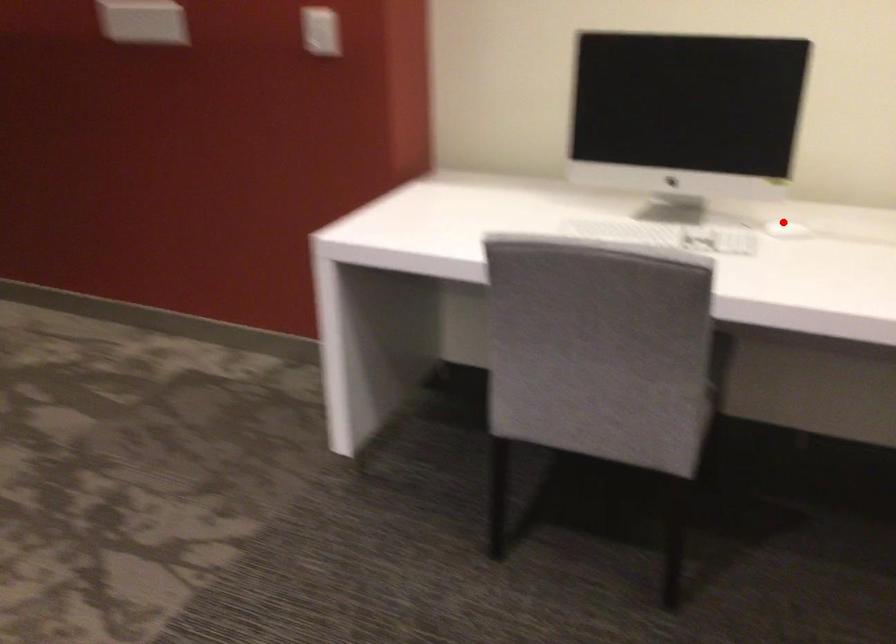
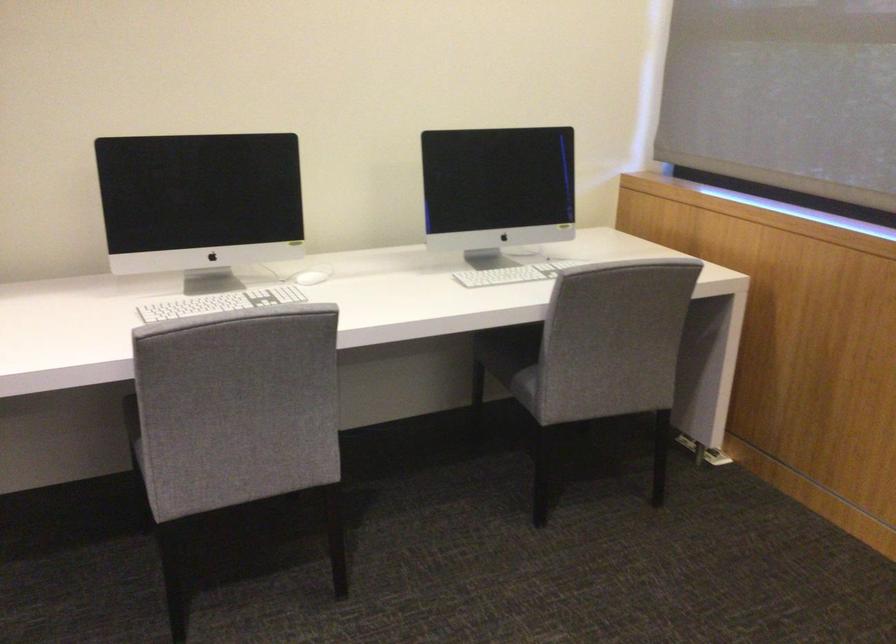
Question: A red point is marked in image1. In image2, is the corresponding 3D point closer to the camera or farther? Reply with the corresponding letter.

Choices:
 (A) The corresponding 3D point is closer.
 (B) The corresponding 3D point is farther.

Answer: (B)